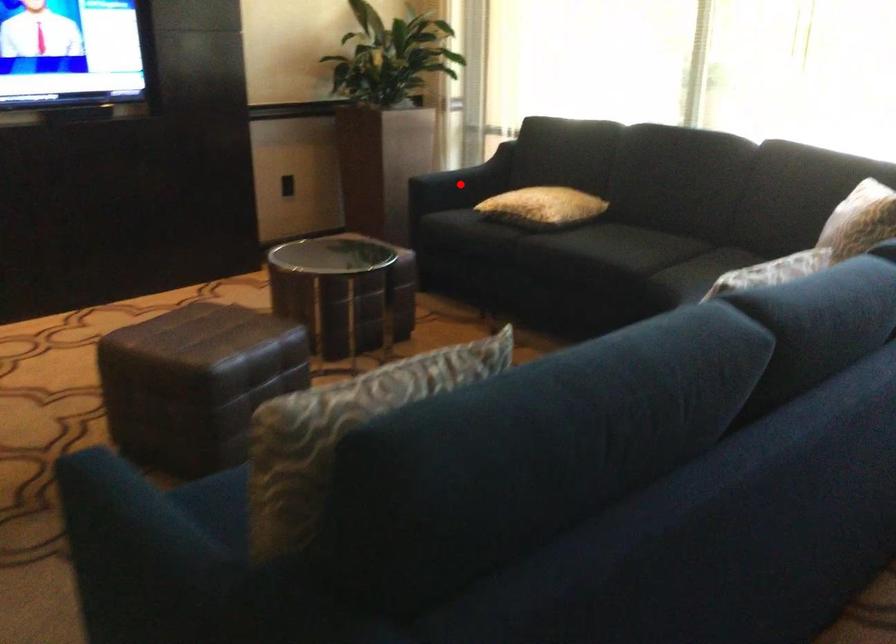
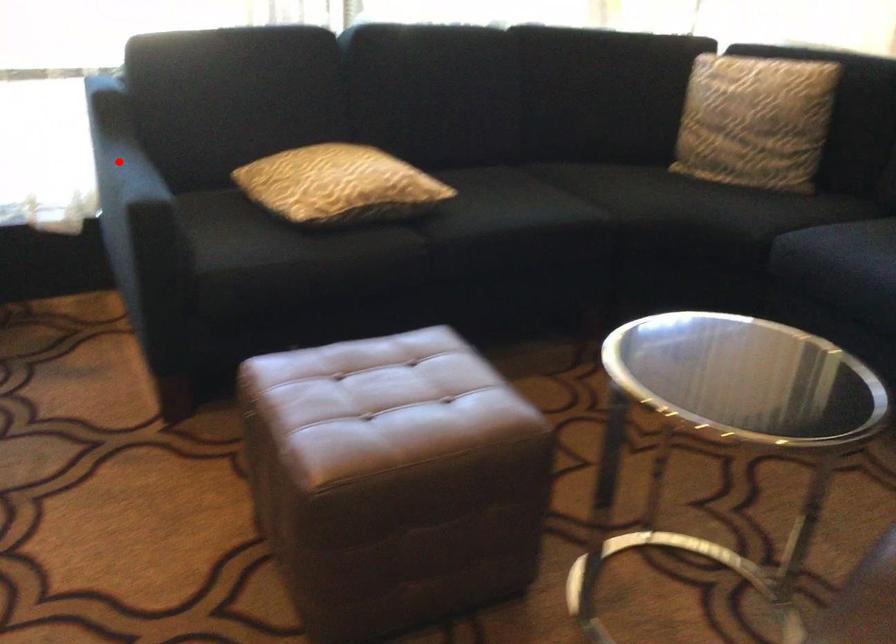
I am providing you with two images of the same scene from different viewpoints. A red point is marked on the first image and another point is marked on the second image. Is the red point in image1 aligned with the point shown in image2?

No